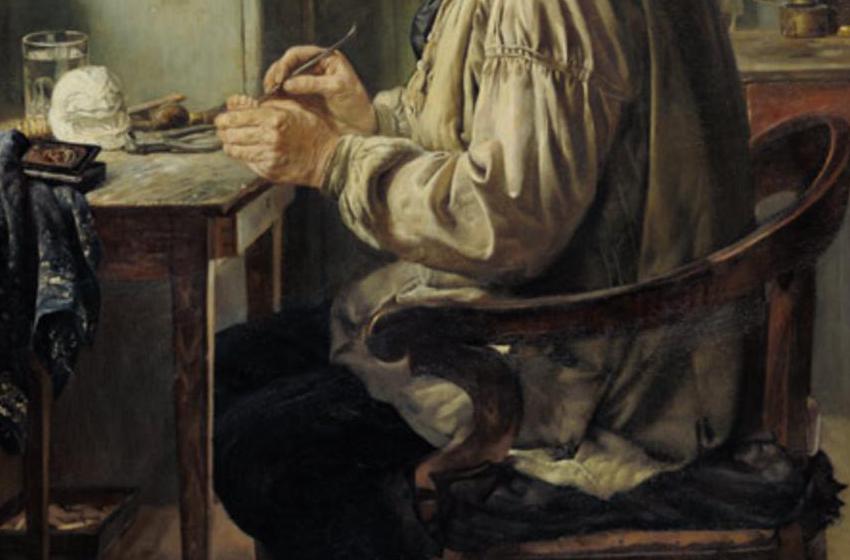
The image size is (850, 560). What are the coordinates of `glass cup` in the screenshot? It's located at (48, 52), (43, 66), (38, 97).